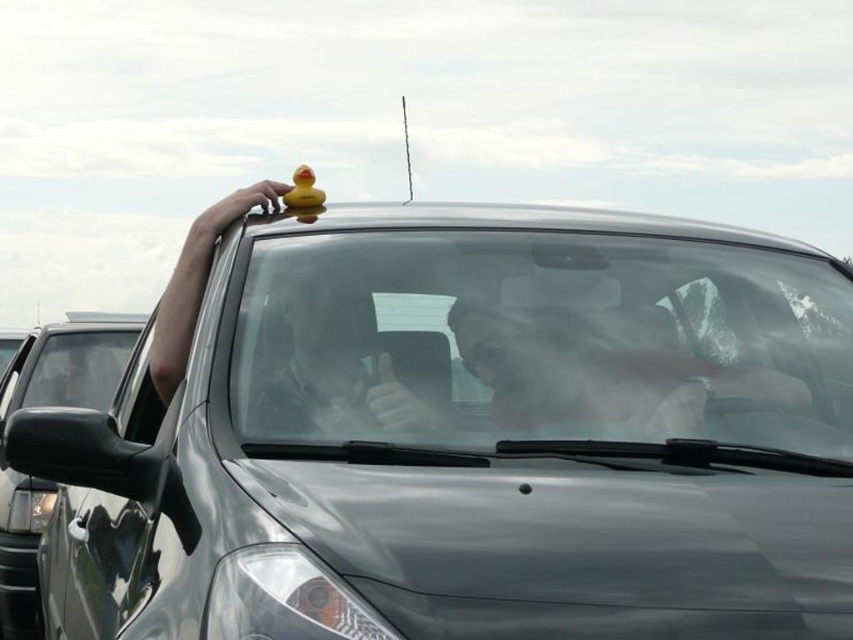
You are a GPS system trying to guide a delivery drone to drop a package onto the roof of the car. The drone needs to avoid the clear glass windshield at center. Where should the drone aim to drop the package?

The clear glass windshield at center is located at point (540,340). The drone should aim to drop the package away from this coordinate to avoid the windshield.

You are a delivery robot trying to determine if you can fit through the space between the clear glass windshield at center and the glossy metallic car at left. Your body is 1.2 meters wide. Can you pass through?

The clear glass windshield at center might be wider than glossy metallic car at left, but without exact measurements, it is uncertain if the space between them is sufficient for the robot to pass through safely.

You are a delivery person who needs to place a package on the roof of the car. The package must be placed above the clear glass windshield at center but below the rubber duck at center. Is this possible?

The clear glass windshield at center is located below the rubber duck at center, so there is no space between them to place the package. It is not possible to place the package in the specified location.